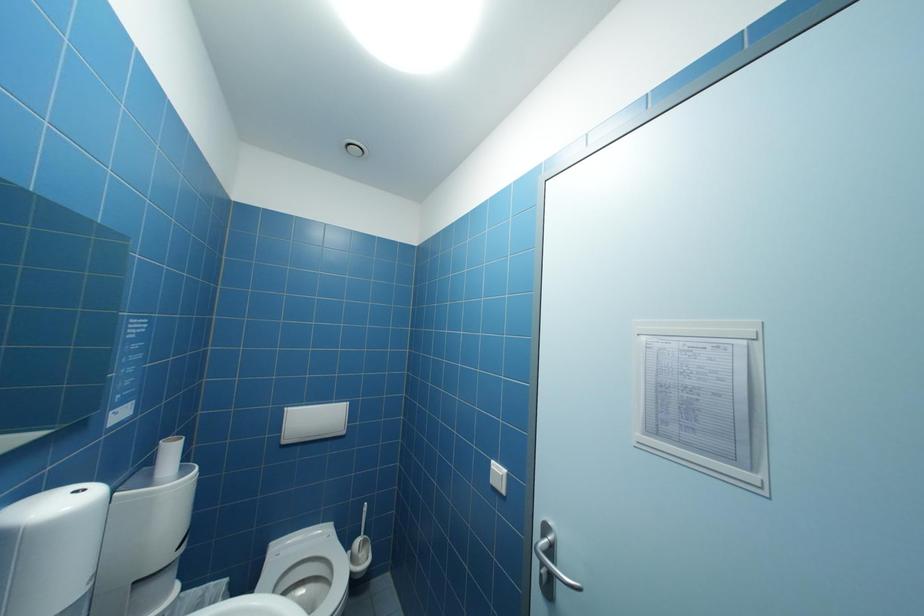
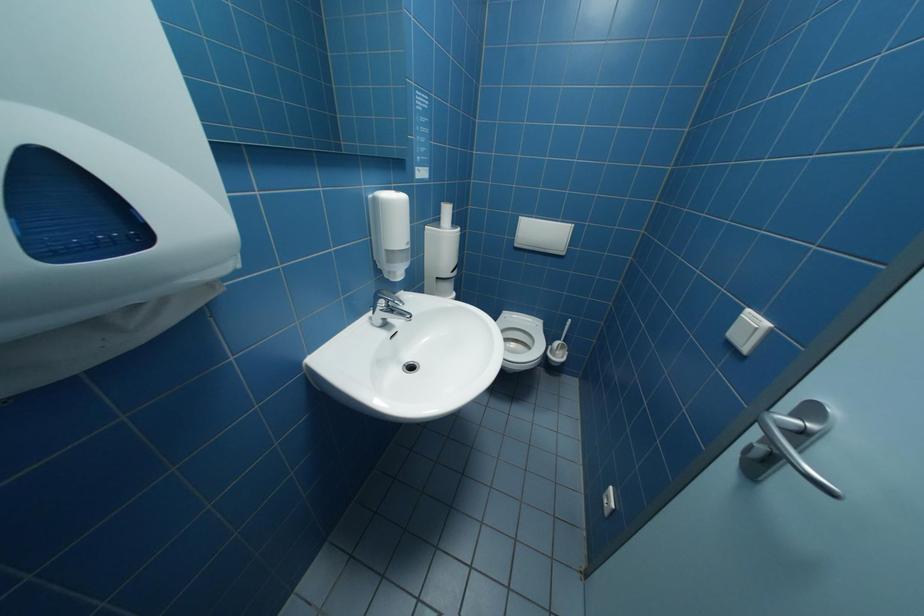
The images are taken continuously from a first-person perspective. In which direction is your viewpoint rotating?

The camera rotated toward left-down.